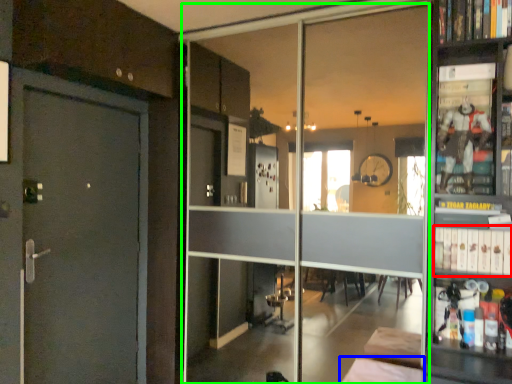
Question: Which is nearer to the book (highlighted by a red box)? furniture (highlighted by a blue box) or glass door (highlighted by a green box).

Choices:
 (A) furniture
 (B) glass door

Answer: (A)